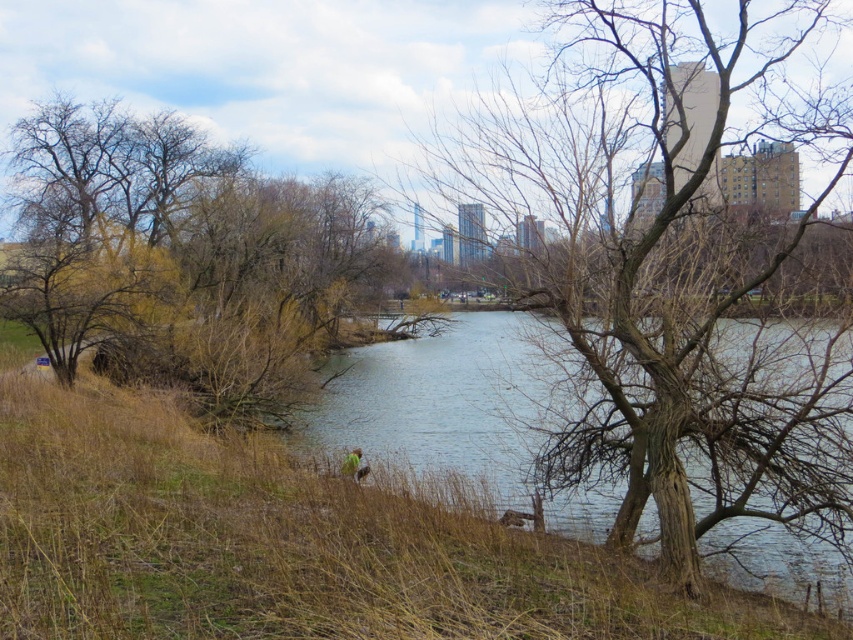
Question: Is bare wood tree at center to the left of green grass at lower center from the viewer's perspective?

Choices:
 (A) yes
 (B) no

Answer: (B)

Question: Does brown leafy tree at left appear over clear water at center?

Choices:
 (A) no
 (B) yes

Answer: (B)

Question: Which point is closer to the camera?

Choices:
 (A) (643, 61)
 (B) (10, 292)
 (C) (358, 456)

Answer: (A)

Question: Which point is farther from the camera taking this photo?

Choices:
 (A) (532, 209)
 (B) (80, 150)
 (C) (341, 465)
 (D) (480, 387)

Answer: (B)

Question: Which object is positioned farthest from the green grass at lower center?

Choices:
 (A) bare wood tree at center
 (B) clear water at center
 (C) brown leafy tree at left

Answer: (C)

Question: Does brown leafy tree at left appear under clear water at center?

Choices:
 (A) yes
 (B) no

Answer: (B)